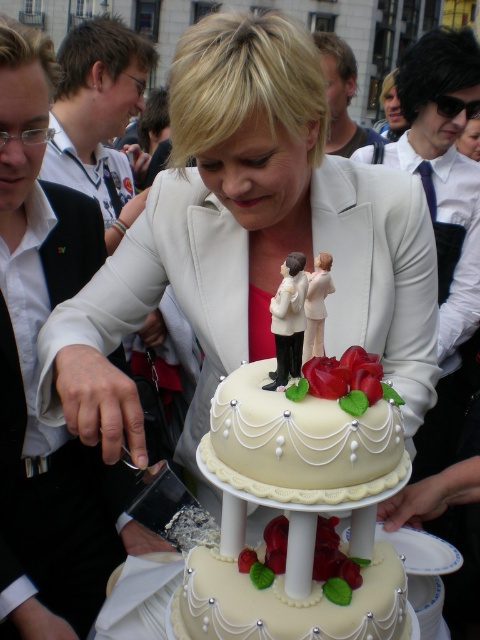
You are at the point labeled as point (54, 166) and want to see the cake cutting scene clearly. Is the point labeled as point (226, 531) blocking your view? Please explain your reasoning.

Point (226, 531) is in front of point (54, 166), so if you are at point (54, 166), the point (226, 531) would block your view of the cake cutting scene.

From the picture: You are at a wedding reception and want to take a photo of the white glossy cake at center. The photographer tells you to stand at the point marked by coordinates (252,236). Where should you position yourself relative to the cake?

The point marked by coordinates (252,236) is located at the white glossy cake at center, so you should stand right at the center of the cake to take the photo.

You are a photographer at the wedding and need to position yourself so that both the ivory fondant cake at center and the brushed metal shirt at left are visible in your shot. Since the cake is shorter than the shirt, where should you stand to ensure both are fully visible?

Since the ivory fondant cake at center is not as tall as the brushed metal shirt at left, you should position yourself at a lower angle to ensure both the shorter cake and the taller shirt are fully visible in the photograph.